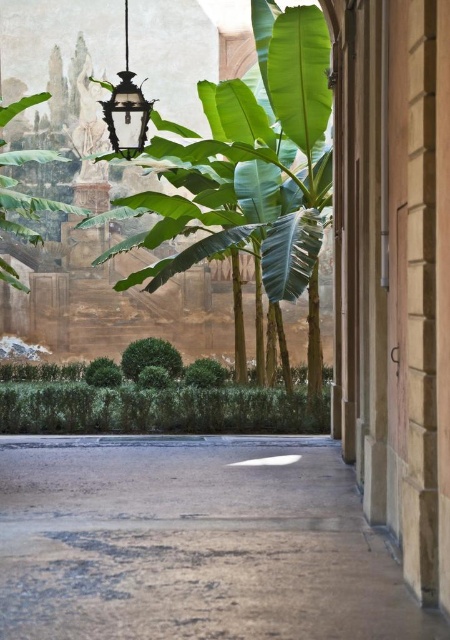
You are a gardener who wants to place a new small decorative item on the paved area near the building. You have a choice between the green leafy banana tree at upper left and the black glass lantern at upper left. Which object should you move to make space, considering their sizes?

The green leafy banana tree at upper left is bigger than the black glass lantern at upper left, so you should move the green leafy banana tree at upper left to make space for the new decorative item.

You are a gardener planning to place a new decorative stone path in the courtyard. The path must be as wide as the green leafy banana tree at upper left. Can the existing concrete sidewalk at center accommodate this width? Please explain.

The concrete sidewalk at center is wider than the green leafy banana tree at upper left, so it can accommodate the width of the new decorative stone path since its width surpasses the tree.